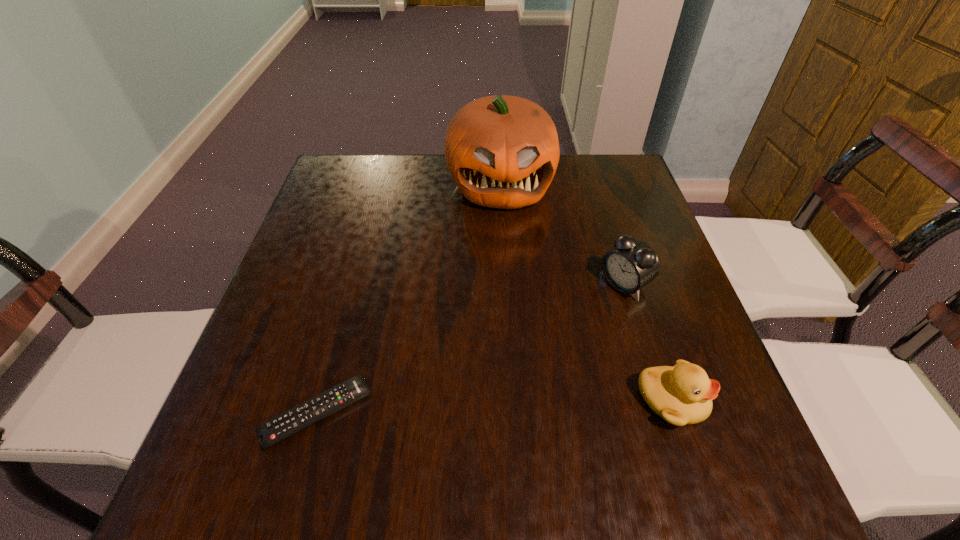
Locate an element on the screen. This screenshot has width=960, height=540. vacant space that satisfies the following two spatial constraints: 1. on the front side of the tallest object; 2. on the front-facing side of the third tallest object is located at coordinates (512, 400).

The width and height of the screenshot is (960, 540). What are the coordinates of `vacant region that satisfies the following two spatial constraints: 1. on the front side of the duckling; 2. on the front-facing side of the alarm clock` in the screenshot? It's located at (660, 400).

I want to click on vacant space that satisfies the following two spatial constraints: 1. on the front side of the duckling; 2. on the front-facing side of the tallest object, so click(x=512, y=400).

Locate an element on the screen. free space that satisfies the following two spatial constraints: 1. on the front side of the third tallest object; 2. on the front-facing side of the third nearest object is located at coordinates (660, 400).

Locate an element on the screen. This screenshot has height=540, width=960. vacant area in the image that satisfies the following two spatial constraints: 1. on the front side of the duckling; 2. on the front-facing side of the second object from left to right is located at coordinates (512, 400).